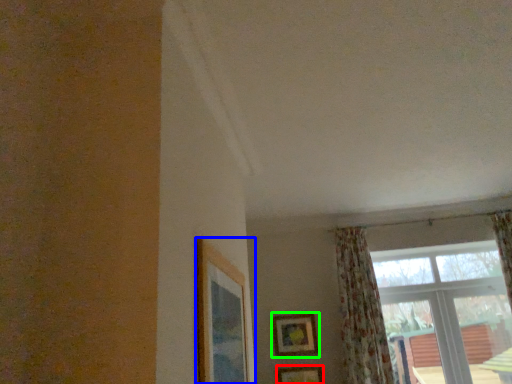
Question: Which object is the farthest from picture frame (highlighted by a red box)? Choose among these: picture frame (highlighted by a blue box) or picture frame (highlighted by a green box).

Choices:
 (A) picture frame
 (B) picture frame

Answer: (A)